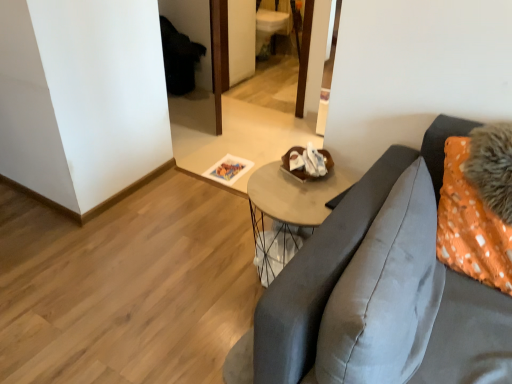
I want to click on free space above wooden round table at center (from a real-world perspective), so click(x=294, y=190).